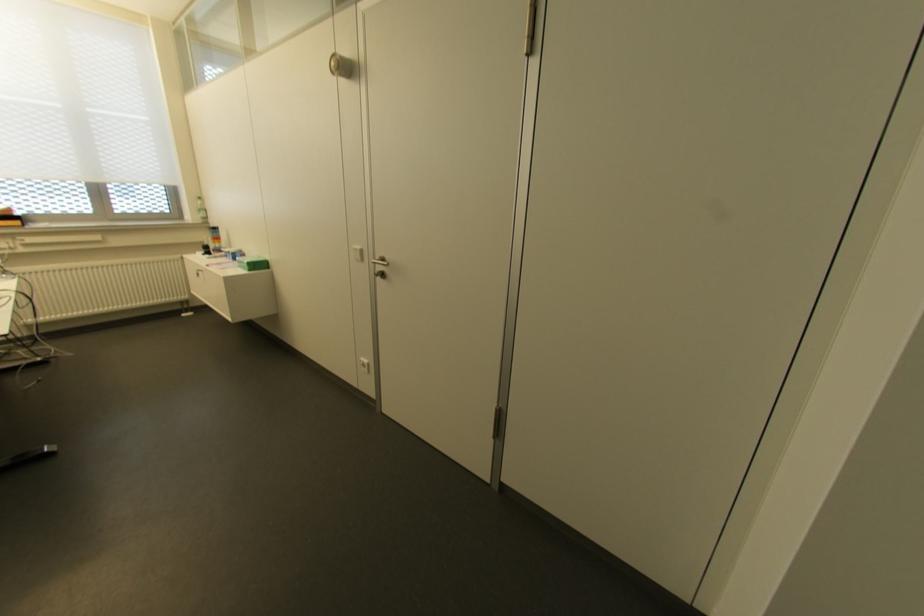
This screenshot has width=924, height=616. I want to click on colorful cylindrical container, so click(213, 241).